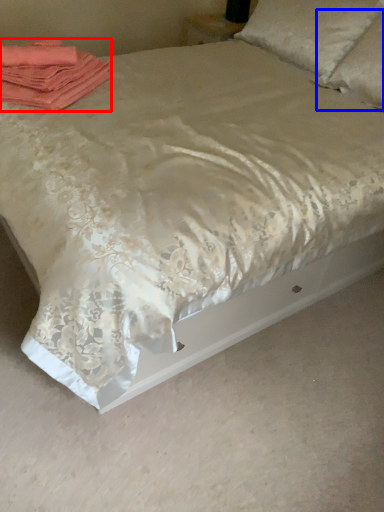
Question: Which object appears closest to the camera in this image, material (highlighted by a red box) or pillow (highlighted by a blue box)?

Choices:
 (A) material
 (B) pillow

Answer: (A)